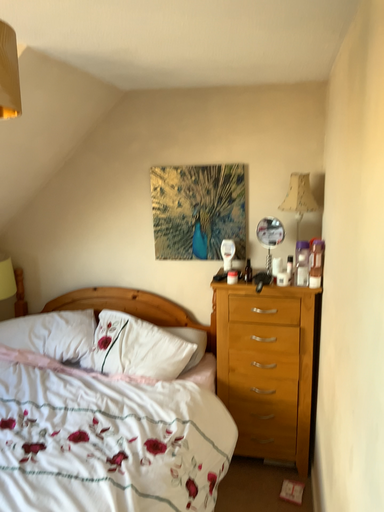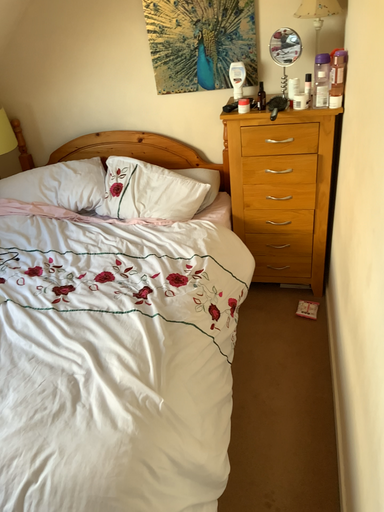
Question: How did the camera likely rotate when shooting the video?

Choices:
 (A) rotated upward
 (B) rotated downward

Answer: (B)